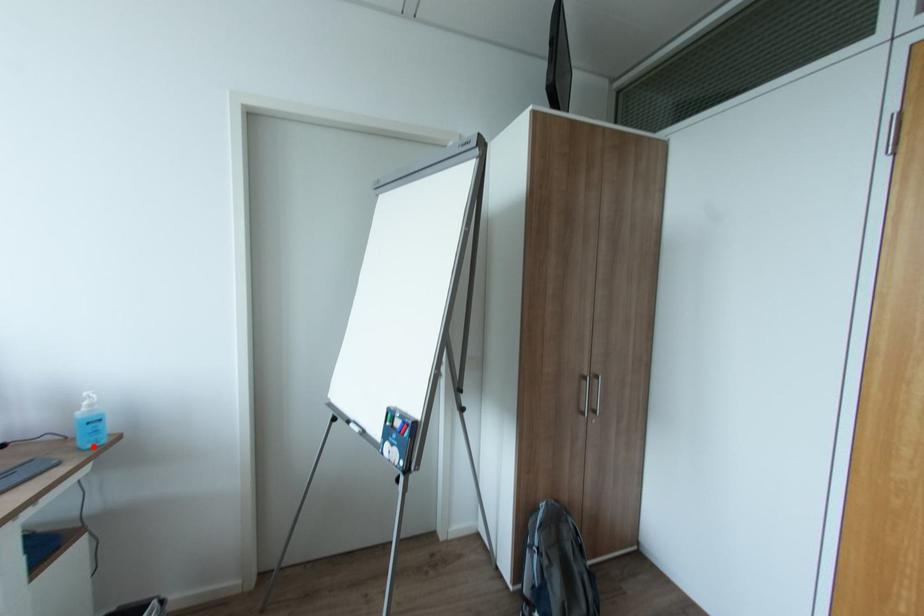
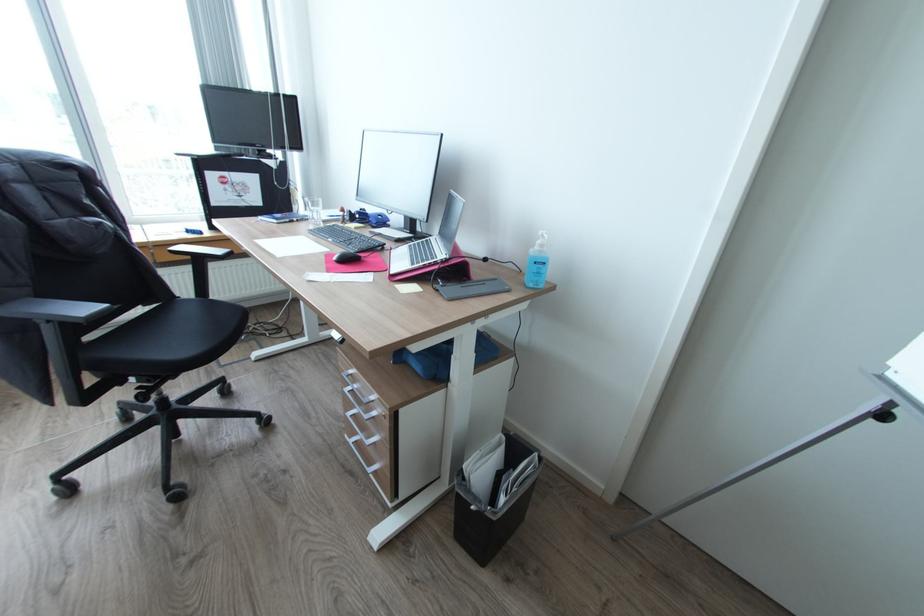
Locate, in the second image, the point that corresponds to the highlighted location in the first image.

(536, 284)